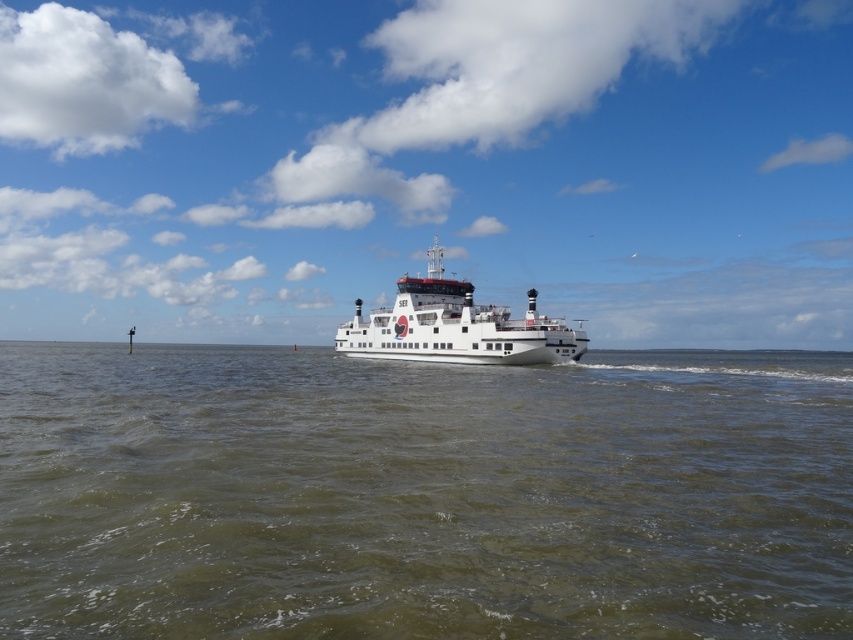
You are standing on the ferry boat and looking at two points marked on the deck. The first point is at coordinate point (x=552, y=365) and the second is at point (x=413, y=308). Which point is closer to you?

Point (x=552, y=365) is closer to the viewer than point (x=413, y=308).

You are a passenger on the ferry and want to take a photo of the water. The ferry has a railing on its upper deck. Can you see the greenish water at center from the upper deck of the white glossy ferry at center?

The greenish water at center is located below the white glossy ferry at center, so yes, you can see the greenish water at center from the upper deck of the white glossy ferry at center as it is positioned below the ferry.